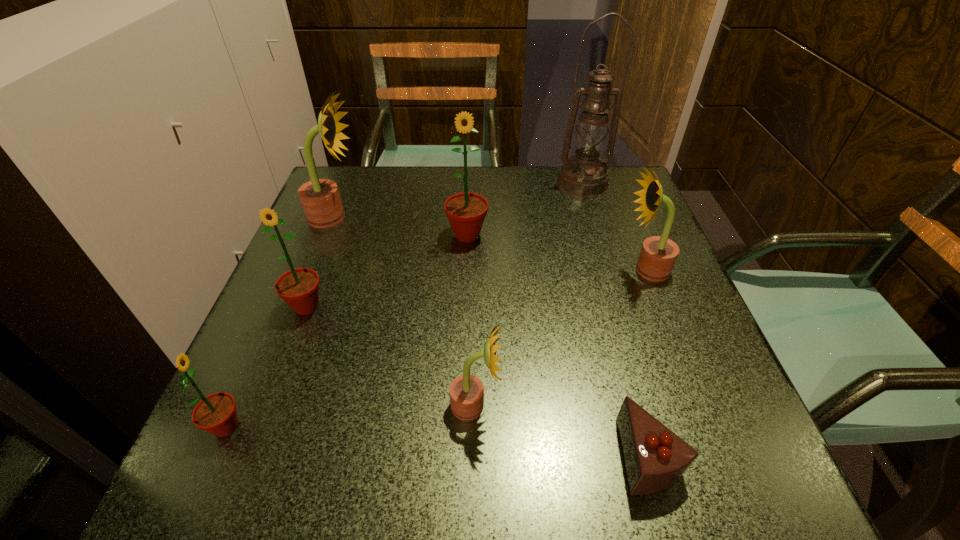
You are a GUI agent. You are given a task and a screenshot of the screen. Output one action in this format:
    pyautogui.click(x=<x>, y=<y>)
    Task: Click on the nearest yellow sunflower
    Image resolution: width=960 pixels, height=540 pixels.
    Given the screenshot: What is the action you would take?
    pyautogui.click(x=466, y=391)

Locate an element on the screen. the smallest yellow sunflower is located at coordinates (466, 391).

Where is `the nearest green sunflower`? The image size is (960, 540). the nearest green sunflower is located at coordinates (216, 413).

This screenshot has width=960, height=540. What are the coordinates of `the shortest object` in the screenshot? It's located at click(655, 458).

The height and width of the screenshot is (540, 960). What are the coordinates of `vacant space located on the front of the oil lamp` in the screenshot? It's located at 592,217.

Where is `vacant space situated on the face of the leftmost yellow sunflower`? vacant space situated on the face of the leftmost yellow sunflower is located at coordinates (460, 218).

Locate an element on the screen. This screenshot has height=540, width=960. vacant space located on the face of the farthest green sunflower is located at coordinates (464, 346).

I want to click on vacant area situated 0.240m on the face of the rightmost yellow sunflower, so click(x=508, y=270).

Where is `vacant region located 0.340m on the face of the rightmost yellow sunflower`? Image resolution: width=960 pixels, height=540 pixels. vacant region located 0.340m on the face of the rightmost yellow sunflower is located at coordinates (461, 270).

At what (x,y) coordinates should I click in order to perform the action: click on blank area located 0.110m on the face of the rightmost yellow sunflower. Please return your answer as a coordinate pair (x, y). The width and height of the screenshot is (960, 540). Looking at the image, I should click on (569, 270).